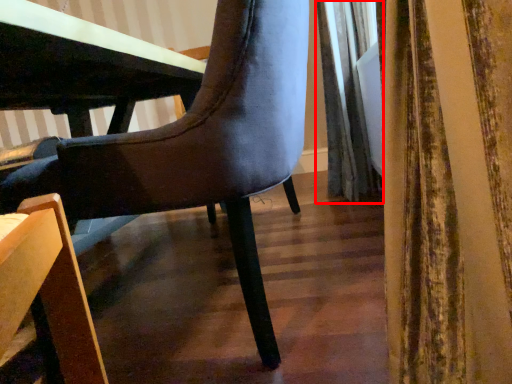
Question: From the image's perspective, considering the relative positions of curtain (annotated by the red box) and chair in the image provided, where is curtain (annotated by the red box) located with respect to the staircase?

Choices:
 (A) below
 (B) above

Answer: (B)